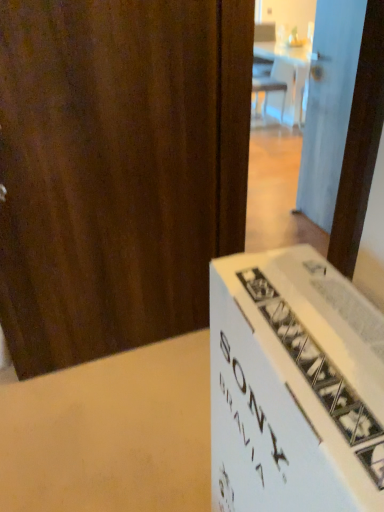
Question: Does white glossy door at upper right, the 1th door in the back-to-front sequence, have a smaller size compared to wooden door at left, the second door in the back-to-front sequence?

Choices:
 (A) yes
 (B) no

Answer: (A)

Question: Is white glossy door at upper right, which is the second door from front to back, completely or partially outside of wooden door at left, which is the first door in left-to-right order?

Choices:
 (A) no
 (B) yes

Answer: (B)

Question: Is white glossy door at upper right, the 1th door in the back-to-front sequence, thinner than wooden door at left, which is the first door in left-to-right order?

Choices:
 (A) no
 (B) yes

Answer: (B)

Question: From the image's perspective, is white glossy door at upper right, the 1th door in the back-to-front sequence, below wooden door at left, the second door in the back-to-front sequence?

Choices:
 (A) yes
 (B) no

Answer: (B)

Question: Is white glossy door at upper right, placed as the 1th door when sorted from right to left, surrounding wooden door at left, which is the first door in left-to-right order?

Choices:
 (A) yes
 (B) no

Answer: (B)

Question: Can you confirm if white glossy door at upper right, placed as the 1th door when sorted from right to left, is positioned to the left of wooden door at left, placed as the 1th door when sorted from front to back?

Choices:
 (A) yes
 (B) no

Answer: (B)

Question: Is wooden door at left, which is the first door in left-to-right order, taller than white glossy door at upper right, the 2th door viewed from the left?

Choices:
 (A) no
 (B) yes

Answer: (B)

Question: Is wooden door at left, placed as the 1th door when sorted from front to back, further to camera compared to white glossy door at upper right, which is the second door from front to back?

Choices:
 (A) yes
 (B) no

Answer: (B)

Question: Can you confirm if wooden door at left, placed as the 1th door when sorted from front to back, is smaller than white glossy door at upper right, which is the second door from front to back?

Choices:
 (A) no
 (B) yes

Answer: (A)

Question: Can you see wooden door at left, the second door when ordered from right to left, touching white glossy door at upper right, placed as the 1th door when sorted from right to left?

Choices:
 (A) no
 (B) yes

Answer: (A)

Question: From a real-world perspective, does wooden door at left, placed as the 1th door when sorted from front to back, stand above white glossy door at upper right, the 1th door in the back-to-front sequence?

Choices:
 (A) yes
 (B) no

Answer: (A)

Question: Is wooden door at left, placed as the 1th door when sorted from front to back, at the left side of white glossy door at upper right, which is the second door from front to back?

Choices:
 (A) yes
 (B) no

Answer: (A)

Question: Is white glossy door at upper right, the 2th door viewed from the left, bigger or smaller than wooden door at left, which is the first door in left-to-right order?

Choices:
 (A) small
 (B) big

Answer: (A)